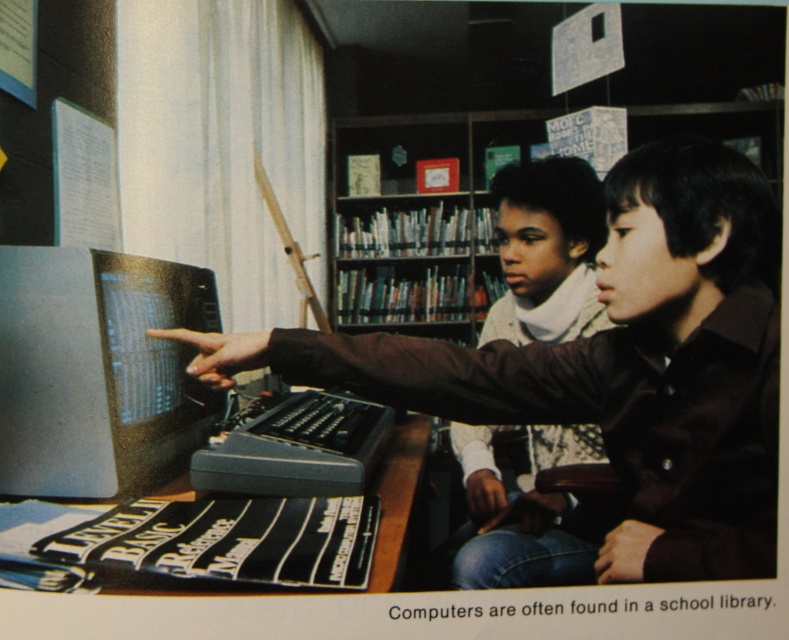
Question: Which point is closer to the camera taking this photo?

Choices:
 (A) (533, 321)
 (B) (709, 163)

Answer: (B)

Question: Which point appears closest to the camera in this image?

Choices:
 (A) (571, 244)
 (B) (623, 284)

Answer: (B)

Question: Does matte black computer at center appear under matte black monitor at center?

Choices:
 (A) no
 (B) yes

Answer: (B)

Question: Which point is closer to the camera?

Choices:
 (A) (394, 381)
 (B) (24, 323)

Answer: (B)

Question: Can you confirm if matte black monitor at center is wider than white knit sweater at center?

Choices:
 (A) yes
 (B) no

Answer: (B)

Question: Is matte black computer at center positioned behind white knit sweater at center?

Choices:
 (A) no
 (B) yes

Answer: (A)